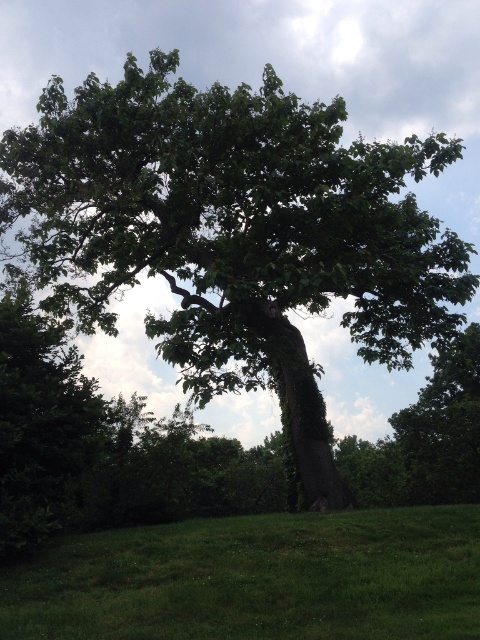
Question: Does green leafy oak tree at center have a lesser width compared to green grass at lower center?

Choices:
 (A) yes
 (B) no

Answer: (B)

Question: Which point is closer to the camera?

Choices:
 (A) (362, 212)
 (B) (72, 563)

Answer: (B)

Question: Is green leafy oak tree at center above green grass at lower center?

Choices:
 (A) no
 (B) yes

Answer: (B)

Question: Which of the following is the closest to the observer?

Choices:
 (A) (217, 100)
 (B) (280, 630)

Answer: (B)

Question: Is green leafy oak tree at center positioned in front of green grass at lower center?

Choices:
 (A) no
 (B) yes

Answer: (A)